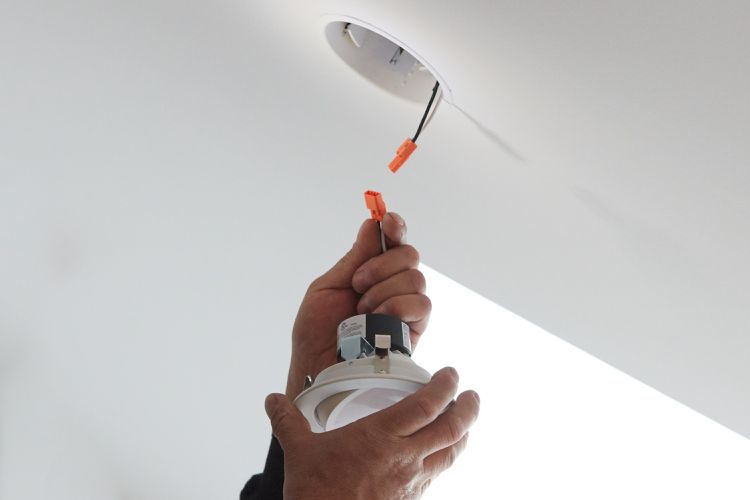
Where is `light`? light is located at coordinates (356, 413).